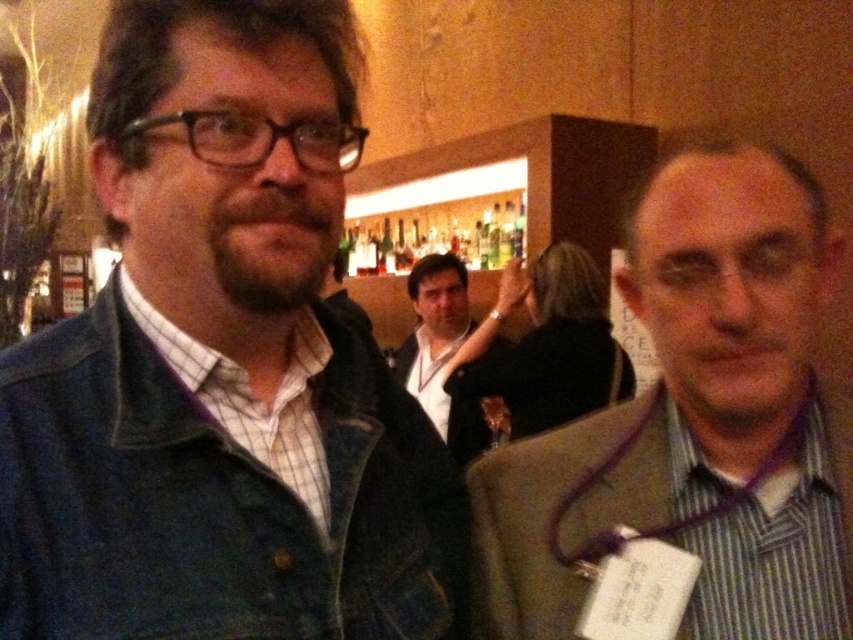
Question: Can you confirm if denim jacket at left is positioned to the left of striped fabric shirt at right?

Choices:
 (A) no
 (B) yes

Answer: (B)

Question: Does striped fabric shirt at right appear over black leather jacket at center?

Choices:
 (A) no
 (B) yes

Answer: (B)

Question: From the image, what is the correct spatial relationship of black leather jacket at center in relation to green glass bottles at center?

Choices:
 (A) left
 (B) right

Answer: (B)

Question: Estimate the real-world distances between objects in this image. Which object is closer to the black leather jacket at center?

Choices:
 (A) striped fabric shirt at right
 (B) denim jacket at left

Answer: (A)

Question: Among these points, which one is farthest from the camera?

Choices:
 (A) (x=529, y=480)
 (B) (x=512, y=301)

Answer: (B)

Question: Which of these objects is positioned closest to the denim jacket at left?

Choices:
 (A) green glass bottles at center
 (B) black leather jacket at center
 (C) striped fabric shirt at right

Answer: (C)